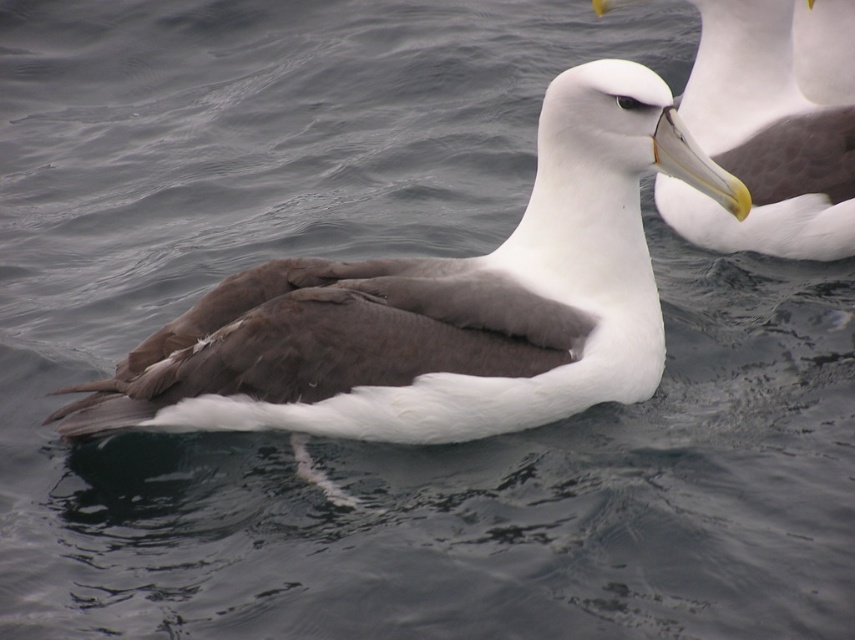
Between point (245, 332) and point (844, 170), which one is positioned in front?

Point (245, 332)

Where is `white matte bird at center`? This screenshot has height=640, width=855. white matte bird at center is located at coordinates (441, 305).